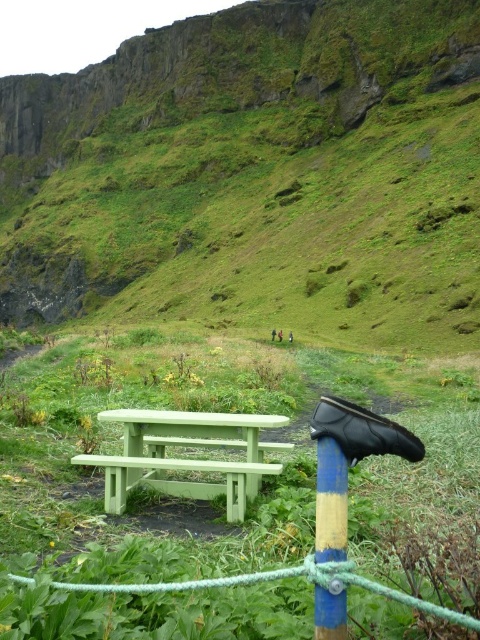
Which is more to the left, green grassy hillside at center or green painted wood bench at center?

green grassy hillside at center is more to the left.

Is point (443, 285) closer to viewer compared to point (97, 460)?

No, it is behind (97, 460).

Does point (84, 301) come behind point (187, 432)?

Yes, it is behind point (187, 432).

The image size is (480, 640). In order to click on green grassy hillside at center in this screenshot , I will do `click(255, 176)`.

Is green painted wood bench at center to the right of blue painted wood pole at center from the viewer's perspective?

Incorrect, green painted wood bench at center is not on the right side of blue painted wood pole at center.

This screenshot has height=640, width=480. What do you see at coordinates (187, 458) in the screenshot? I see `green painted wood bench at center` at bounding box center [187, 458].

Who is more forward, (176, 486) or (331, 448)?

Point (331, 448) is more forward.

Image resolution: width=480 pixels, height=640 pixels. What are the coordinates of `green painted wood bench at center` in the screenshot? It's located at (187, 458).

Does point (335, 273) come behind point (328, 438)?

Yes.

This screenshot has width=480, height=640. In order to click on green grassy hillside at center in this screenshot , I will do `click(255, 176)`.